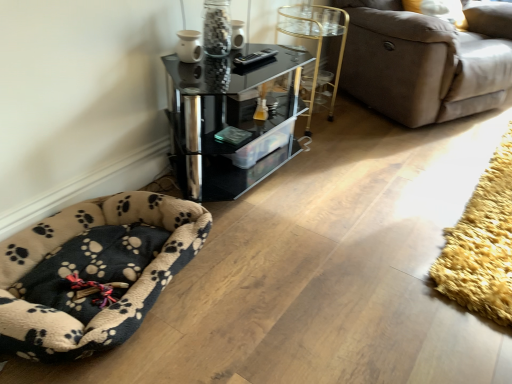
You are a GUI agent. You are given a task and a screenshot of the screen. Output one action in this format:
    pyautogui.click(x=<x>, y=<y>)
    Task: Click on the empty space that is in between black glass table at upper center and beige fleece dog bed at lower left
    The width and height of the screenshot is (512, 384).
    Given the screenshot: What is the action you would take?
    pyautogui.click(x=265, y=203)